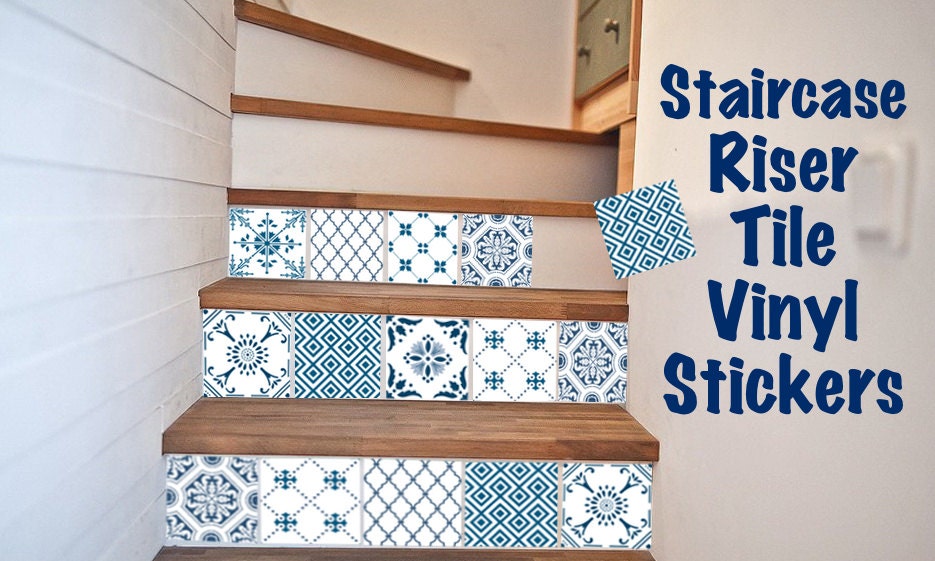
Find the location of `wooden frame around drawer`. wooden frame around drawer is located at coordinates (595, 117), (631, 82), (576, 116), (626, 146).